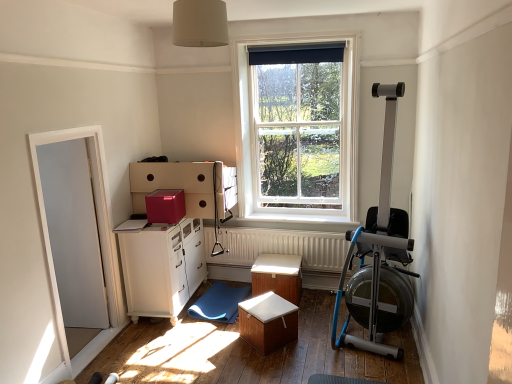
Locate an element on the screen. unoccupied region to the right of wooden table at center, the first table positioned from the front is located at coordinates (311, 342).